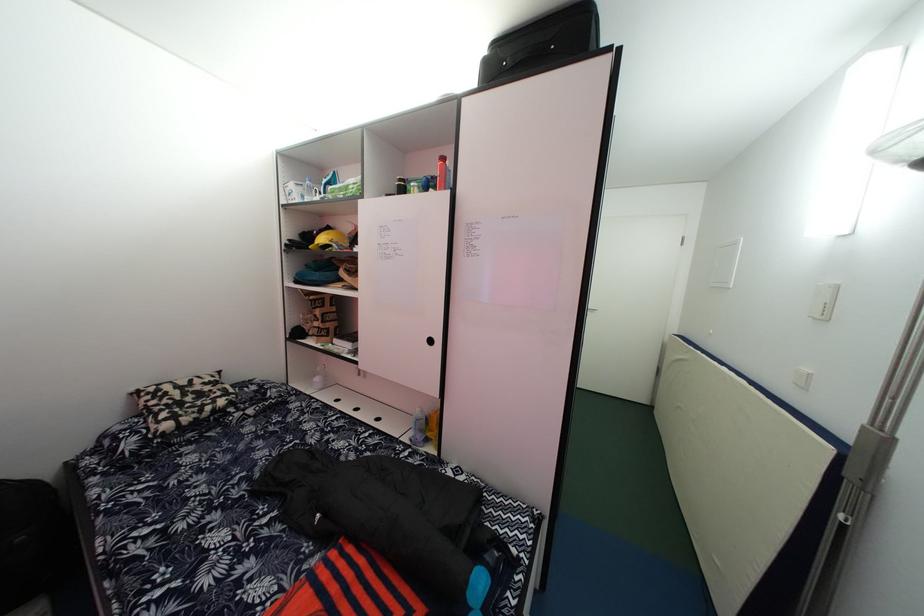
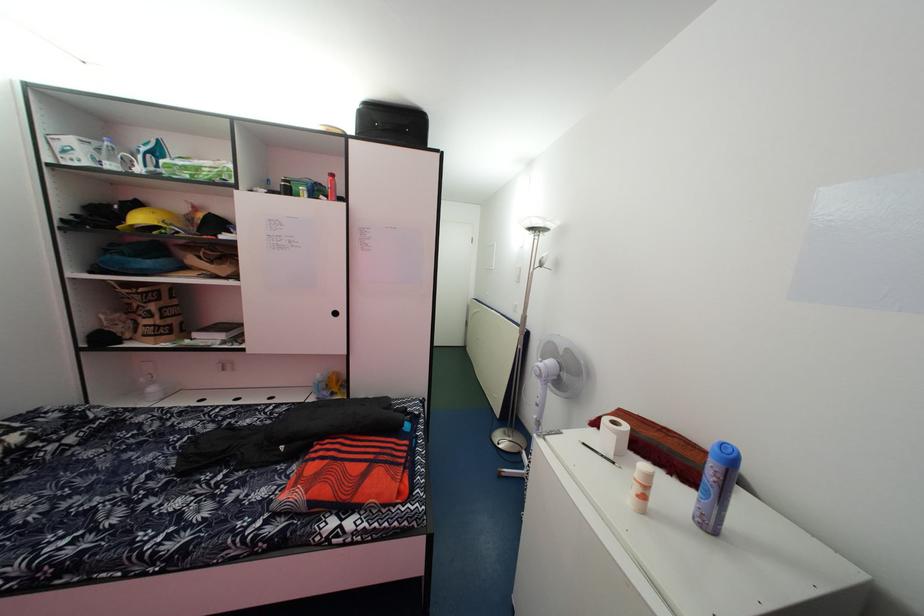
In the second image, find the point that corresponds to the point at 494,60 in the first image.

(367, 111)